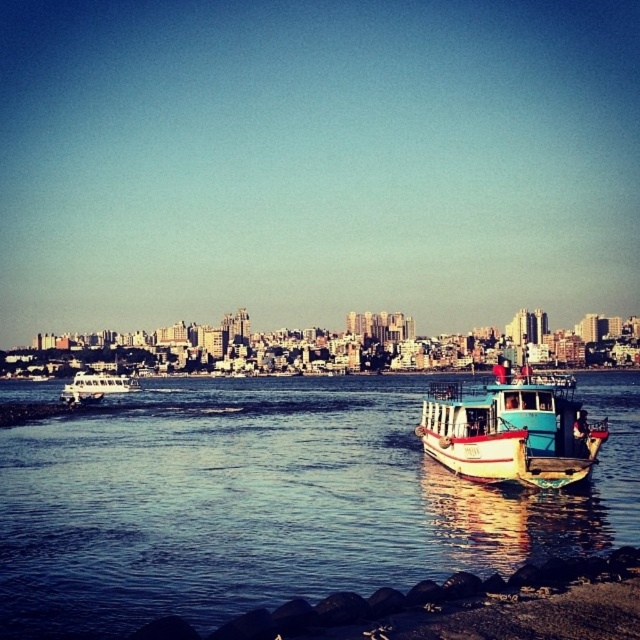
Which is behind, point (442, 554) or point (84, 385)?

Positioned behind is point (84, 385).

Who is lower down, white matte boat at lower right or white matte boat at left?

white matte boat at lower right is lower down.

Which is in front, point (1, 605) or point (76, 372)?

Point (1, 605) is more forward.

Locate an element on the screen. The image size is (640, 640). white matte boat at lower right is located at coordinates (272, 502).

Which of these two, white matte boat at lower right or teal wooden boat at right, stands taller?

With more height is teal wooden boat at right.

The height and width of the screenshot is (640, 640). What do you see at coordinates (272, 502) in the screenshot?
I see `white matte boat at lower right` at bounding box center [272, 502].

Is point (188, 541) closer to camera compared to point (524, 376)?

That is True.

Locate an element on the screen. white matte boat at lower right is located at coordinates (272, 502).

Is teal wooden boat at right wider than white matte boat at left?

Indeed, teal wooden boat at right has a greater width compared to white matte boat at left.

Can you confirm if teal wooden boat at right is positioned to the left of white matte boat at left?

No, teal wooden boat at right is not to the left of white matte boat at left.

Does point (580, 472) lie in front of point (83, 376)?

Yes, point (580, 472) is closer to viewer.

At what (x,y) coordinates should I click in order to perform the action: click on teal wooden boat at right. Please return your answer as a coordinate pair (x, y). Image resolution: width=640 pixels, height=640 pixels. Looking at the image, I should click on (512, 428).